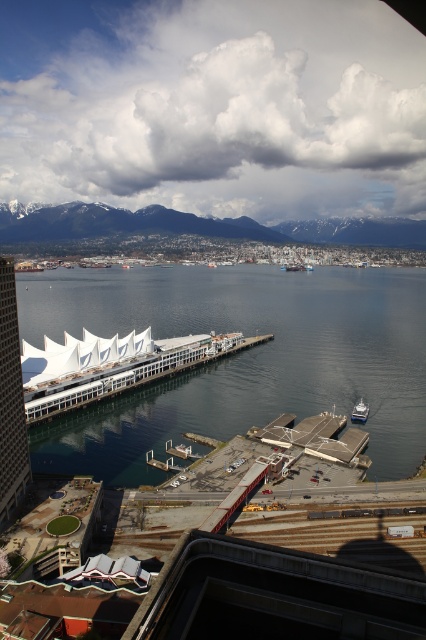
You are standing at the vantage point overlooking the coastal urban area. There is a point marked at coordinates (238, 358). What is located at that point?

The point at coordinates (238, 358) corresponds to clear blue water at center.

You are a photographer planning to capture a landscape shot of the coastal area. You want to ensure that the clear blue water at center and the metallic silver boat at lower right are both visible in the frame. Based on their heights, which object will appear taller in your photo?

The clear blue water at center appears taller in the photo because it has a greater height compared to the metallic silver boat at lower right.